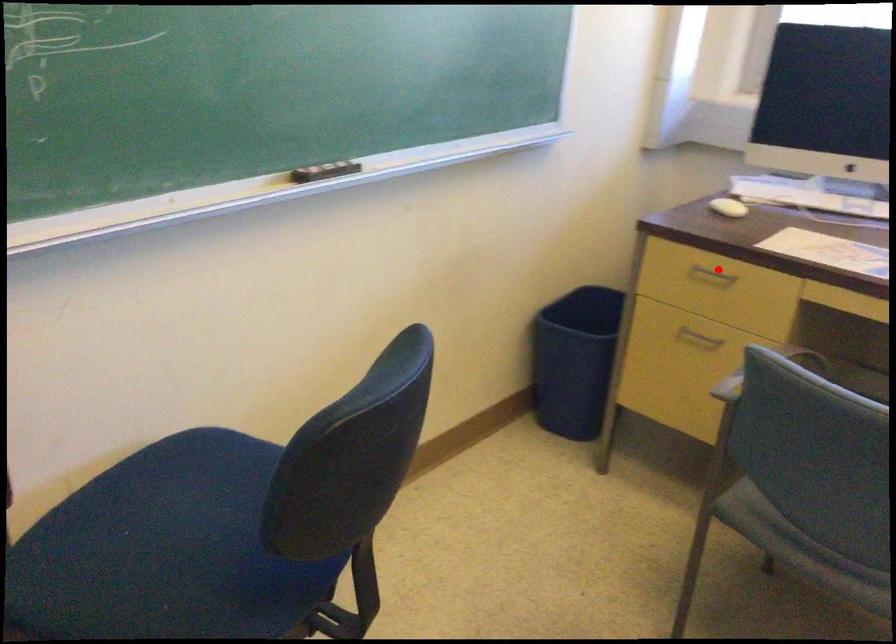
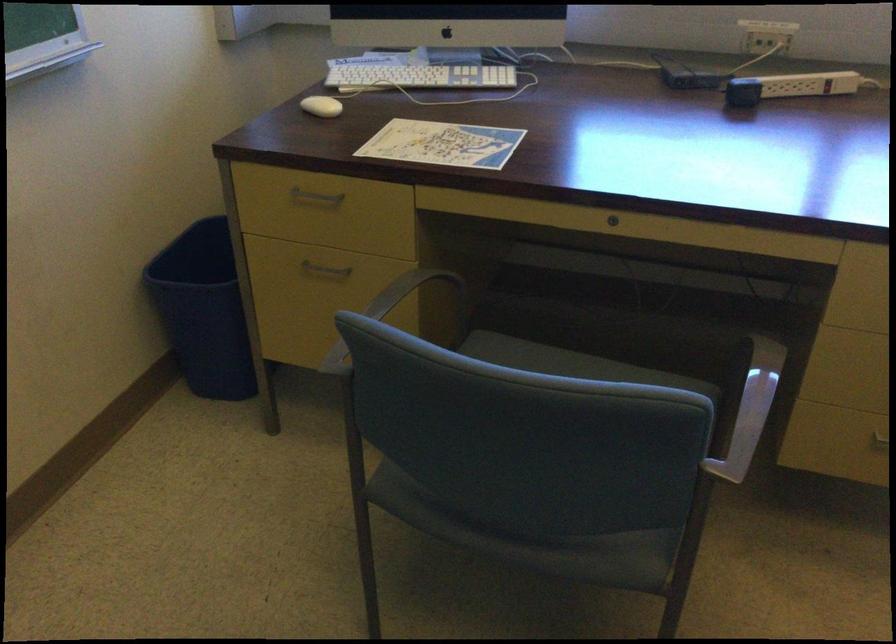
Locate, in the second image, the point that corresponds to the highlighted location in the first image.

(315, 196)